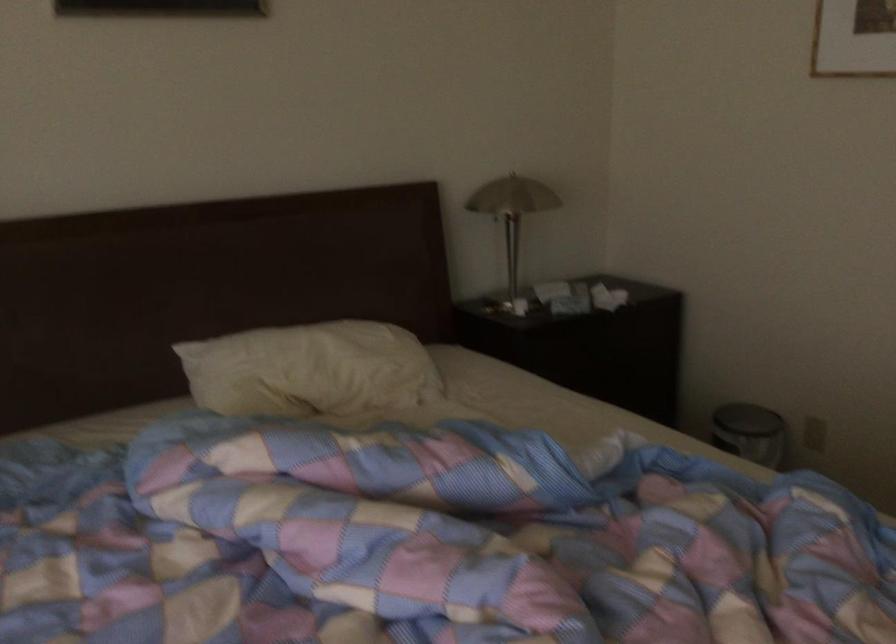
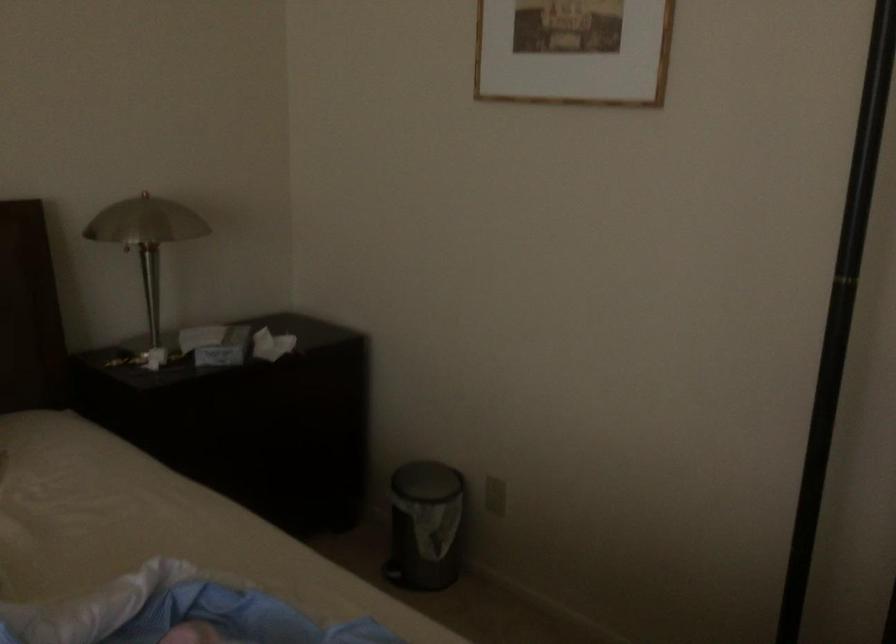
Locate, in the second image, the point that corresponds to point 564,292 in the first image.

(216, 344)